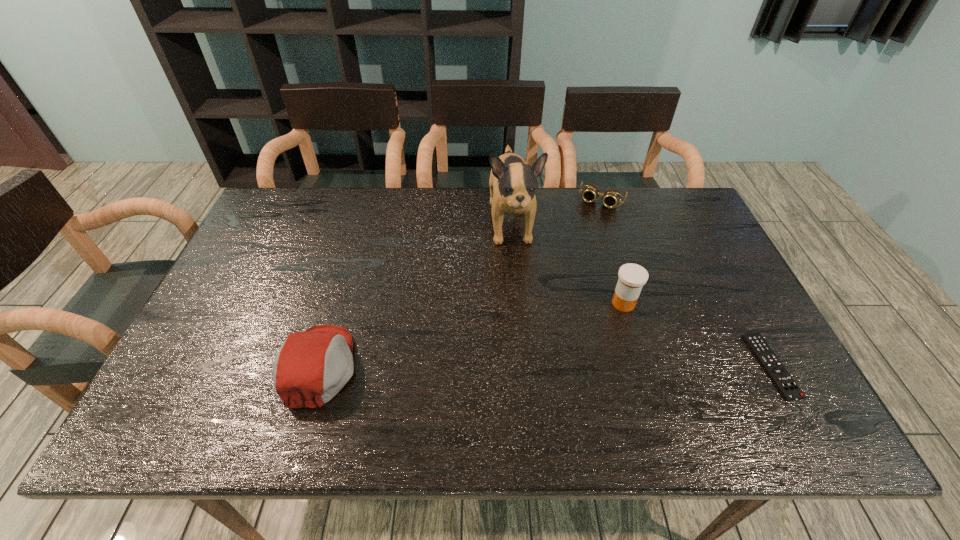
This screenshot has width=960, height=540. Identify the location of cap that is at the near edge. (311, 367).

The height and width of the screenshot is (540, 960). In order to click on remote control that is positioned at the near edge in this screenshot , I will do `click(784, 382)`.

Find the location of `object that is at the right edge`. object that is at the right edge is located at coordinates (784, 382).

This screenshot has width=960, height=540. What are the coordinates of `object at the near right corner` in the screenshot? It's located at (784, 382).

What are the coordinates of `vacant space at the far edge` in the screenshot? It's located at (572, 215).

This screenshot has width=960, height=540. Find the location of `blank space at the near edge`. blank space at the near edge is located at coordinates (385, 397).

You are a GUI agent. You are given a task and a screenshot of the screen. Output one action in this format:
    pyautogui.click(x=<x>, y=<y>)
    Task: Click on the vacant space at the left edge of the desktop
    The image size is (960, 540).
    Given the screenshot: What is the action you would take?
    (227, 300)

This screenshot has height=540, width=960. In the image, there is a desktop. Identify the location of vacant space at the far left corner. (297, 219).

I want to click on vacant space at the near left corner, so click(x=237, y=386).

Locate an element on the screen. The height and width of the screenshot is (540, 960). free point at the far right corner is located at coordinates (676, 231).